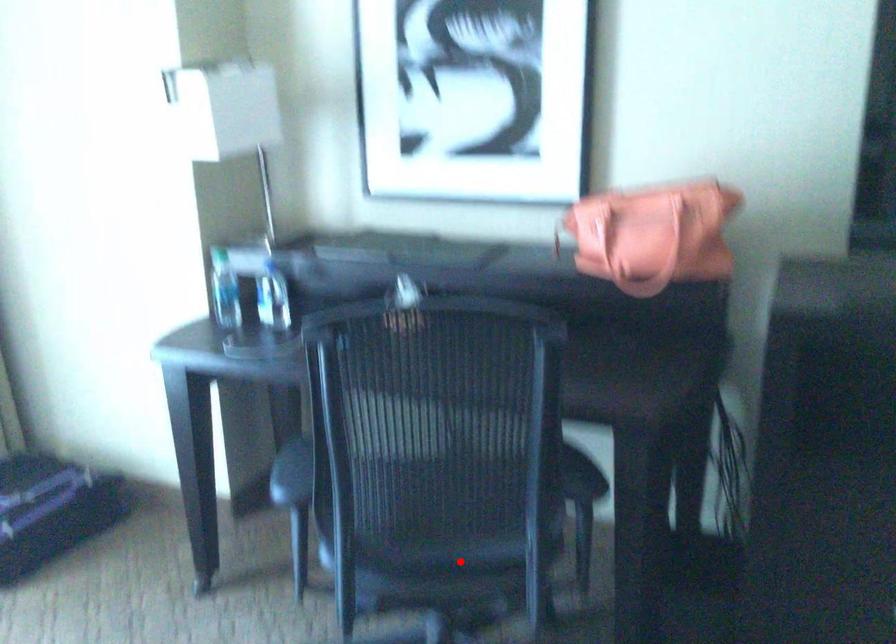
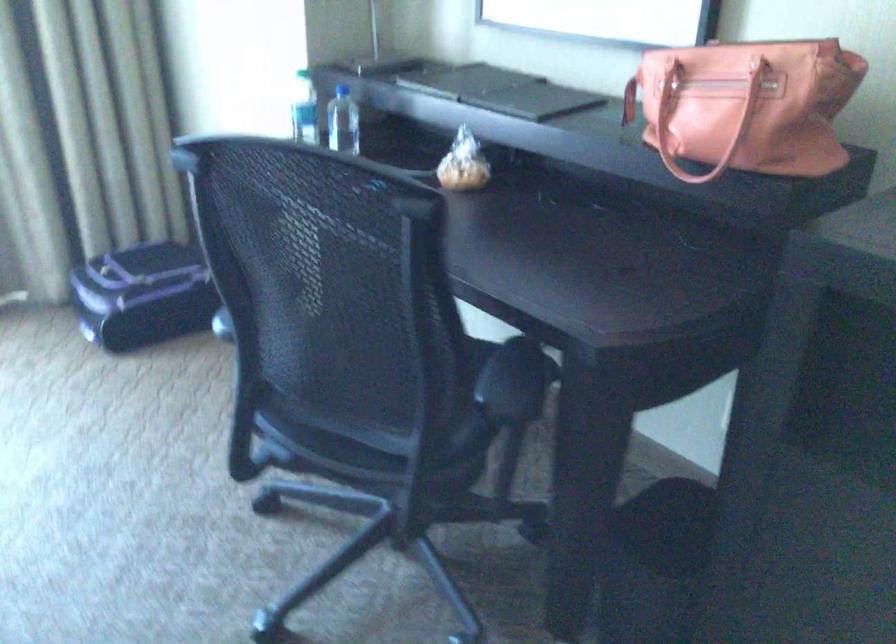
Find the pixel in the second image that matches the highlighted location in the first image.

(364, 440)